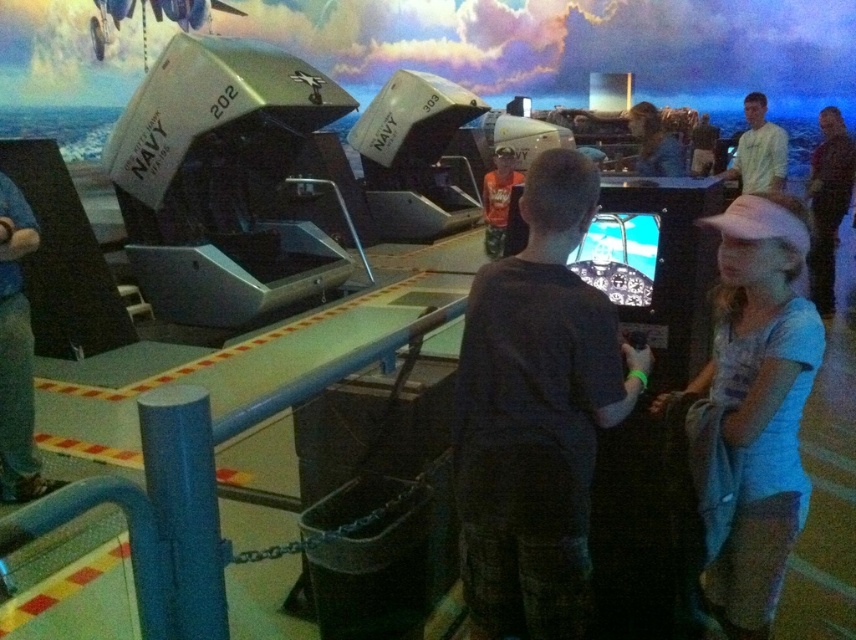
Which of these two, dark gray shirt at center or white t-shirt at upper right, stands taller?

Answer: Standing taller between the two is dark gray shirt at center.

Does dark gray shirt at center appear under white t-shirt at upper right?

Yes, dark gray shirt at center is below white t-shirt at upper right.

What do you see at coordinates (536, 413) in the screenshot? Image resolution: width=856 pixels, height=640 pixels. I see `dark gray shirt at center` at bounding box center [536, 413].

This screenshot has height=640, width=856. What are the coordinates of `dark gray shirt at center` in the screenshot? It's located at pos(536,413).